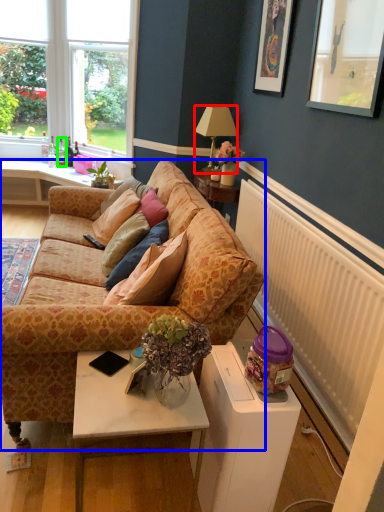
Question: Considering the real-world distances, which object is farthest from lamp (highlighted by a red box)? studio couch (highlighted by a blue box) or bottle (highlighted by a green box)?

Choices:
 (A) studio couch
 (B) bottle

Answer: (A)